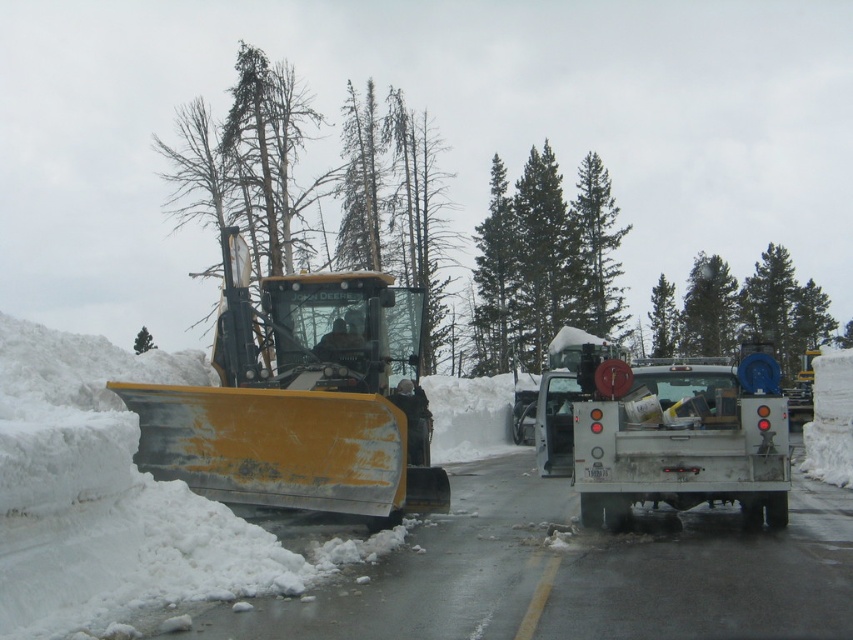
Which of these two, green coniferous trees at center or green matte tree at upper left, stands shorter?

Standing shorter between the two is green matte tree at upper left.

How distant is green coniferous trees at center from green matte tree at upper left?

The distance of green coniferous trees at center from green matte tree at upper left is 112.19 feet.

Is point (578, 192) more distant than point (141, 348)?

Yes.

This screenshot has width=853, height=640. Find the location of `green coniferous trees at center`. green coniferous trees at center is located at coordinates (544, 260).

Can you confirm if green textured tree at upper center is wider than green textured tree at center?

Correct, the width of green textured tree at upper center exceeds that of green textured tree at center.

Is green textured tree at upper center thinner than green textured tree at center?

In fact, green textured tree at upper center might be wider than green textured tree at center.

Who is more forward, (767,310) or (660,316)?

Point (767,310) is more forward.

This screenshot has height=640, width=853. In order to click on green textured tree at upper center in this screenshot , I will do `click(741, 310)`.

Does yellow metallic snowplow at left have a lesser height compared to green textured pine tree at center?

Correct, yellow metallic snowplow at left is not as tall as green textured pine tree at center.

Does yellow metallic snowplow at left lie in front of green textured pine tree at center?

That is True.

The width and height of the screenshot is (853, 640). I want to click on yellow metallic snowplow at left, so click(x=300, y=401).